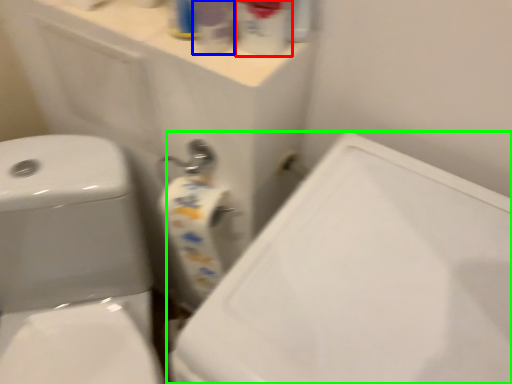
Question: Estimate the real-world distances between objects in this image. Which object is farther from cleaning product (highlighted by a red box), cleaning product (highlighted by a blue box) or porcelain (highlighted by a green box)?

Choices:
 (A) cleaning product
 (B) porcelain

Answer: (B)